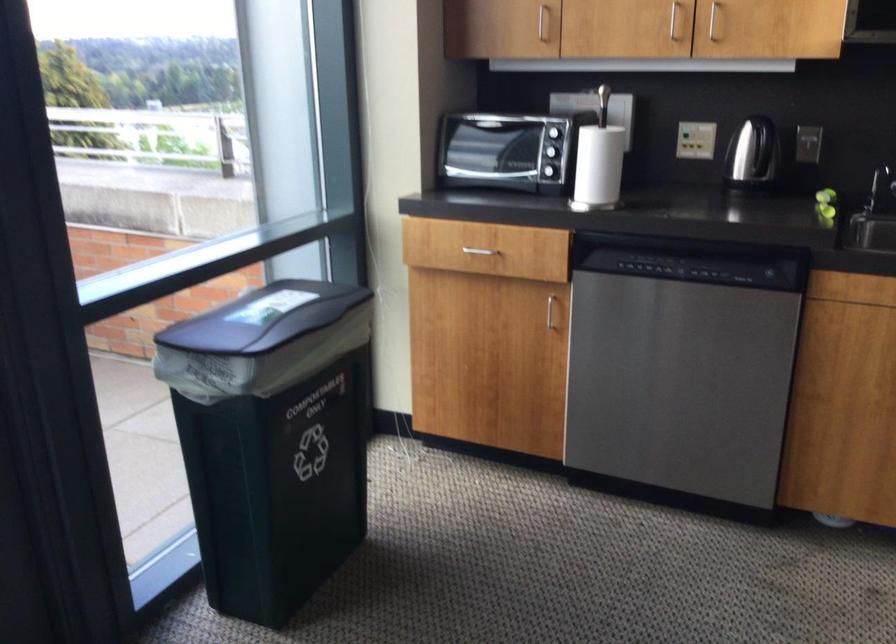
At what (x,y) coordinates should I click in order to perform the action: click on silver drawer handle. Please return your answer as a coordinate pair (x, y). This screenshot has height=644, width=896. Looking at the image, I should click on (474, 241).